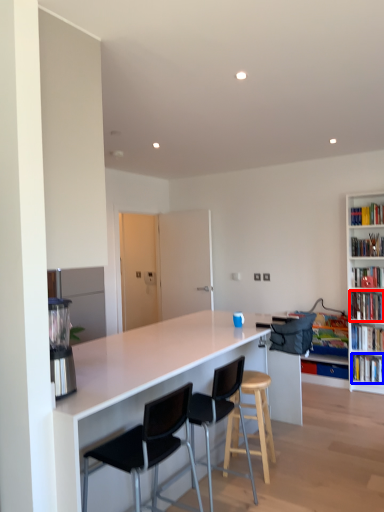
Question: Which object appears farthest to the camera in this image, book (highlighted by a red box) or book (highlighted by a blue box)?

Choices:
 (A) book
 (B) book

Answer: (B)